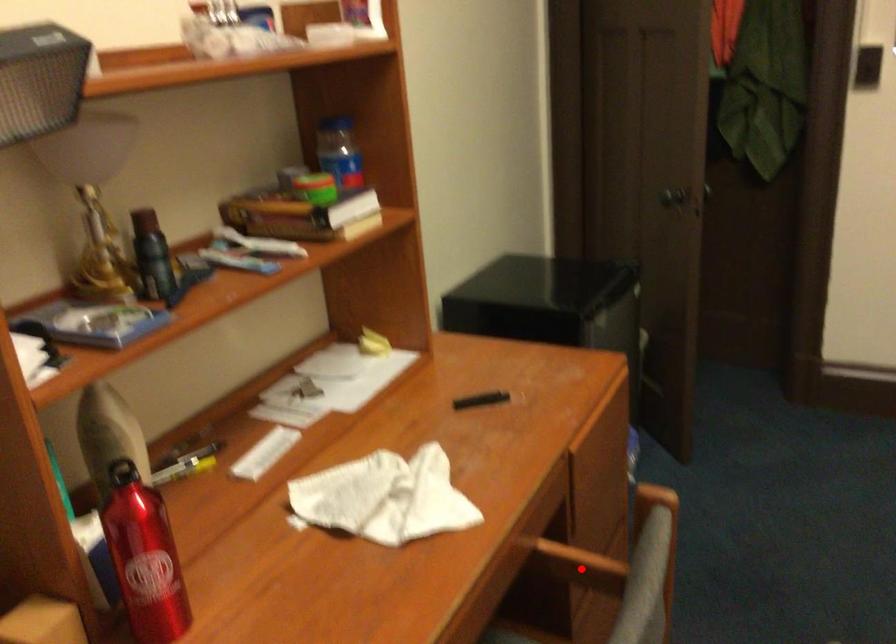
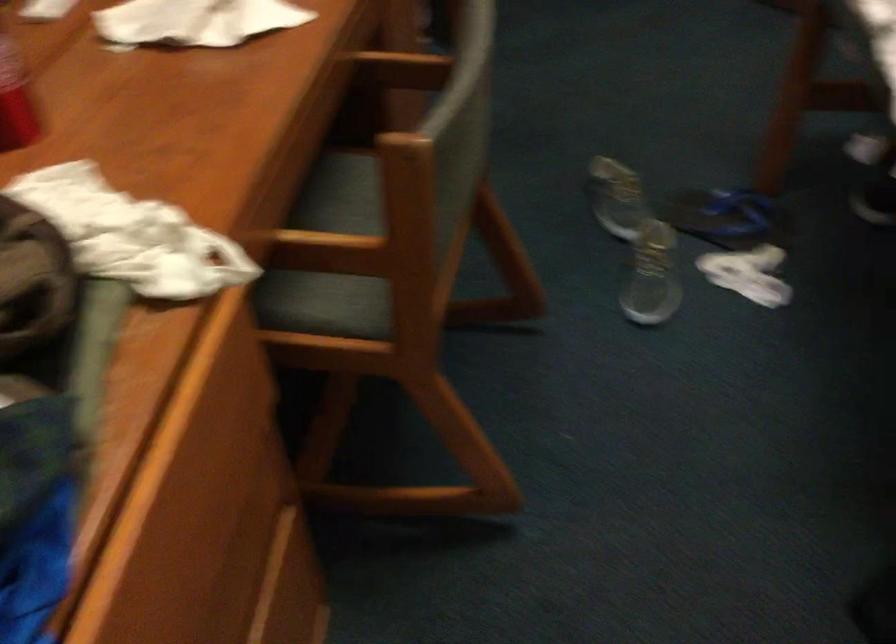
The point at the highlighted location is marked in the first image. Where is the corresponding point in the second image?

(401, 69)